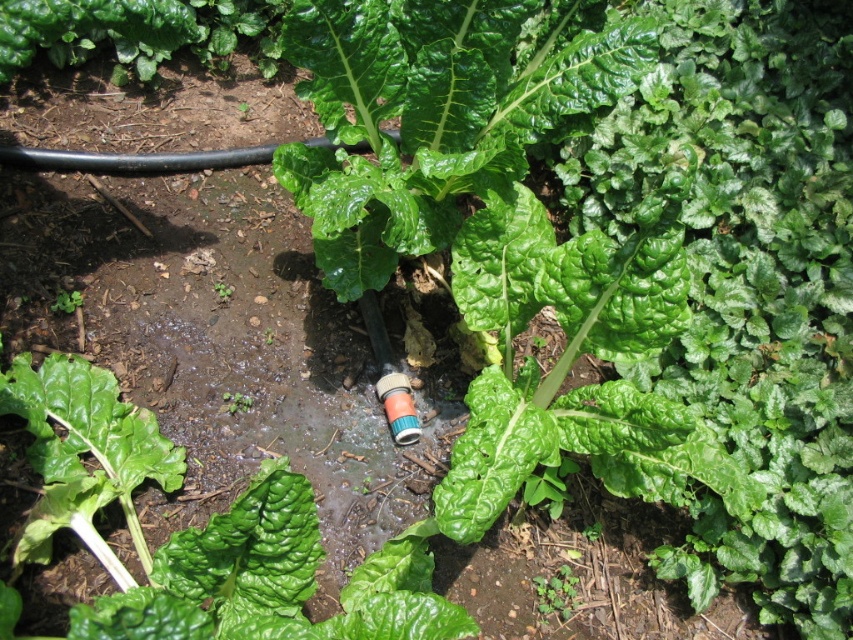
Can you confirm if green leafy plant at upper left is bigger than green leafy at center?

Yes.

Who is higher up, green leafy plant at upper left or green leafy at center?

green leafy plant at upper left

What do you see at coordinates (135, 29) in the screenshot?
I see `green leafy plant at upper left` at bounding box center [135, 29].

Image resolution: width=853 pixels, height=640 pixels. What are the coordinates of `green leafy plant at upper left` in the screenshot? It's located at point(135,29).

Who is more forward, [558,572] or [68,292]?

Point [558,572] is more forward.

Does green leafy at center have a smaller size compared to green leafy plant at lower left?

No.

The image size is (853, 640). What do you see at coordinates (556, 593) in the screenshot? I see `green leafy at center` at bounding box center [556, 593].

Find the location of `green leafy at center`. green leafy at center is located at coordinates (556, 593).

Can you confirm if green leafy plant at upper left is taller than green leafy plant at lower left?

Correct, green leafy plant at upper left is much taller as green leafy plant at lower left.

Who is more forward, (4, 68) or (73, 296)?

Point (4, 68) is in front.

Identify the location of green leafy plant at upper left. (135, 29).